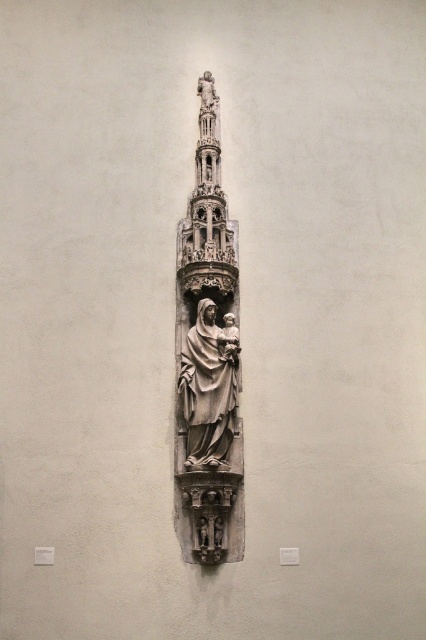
In the scene shown: Who is lower down, stone statue at center or matte gray statue at center?

matte gray statue at center is below.

In the scene shown: Does stone statue at center have a larger size compared to matte gray statue at center?

Correct, stone statue at center is larger in size than matte gray statue at center.

Is point (241, 429) closer to camera compared to point (230, 417)?

No, it is behind (230, 417).

Locate an element on the screen. This screenshot has width=426, height=640. stone statue at center is located at coordinates (207, 360).